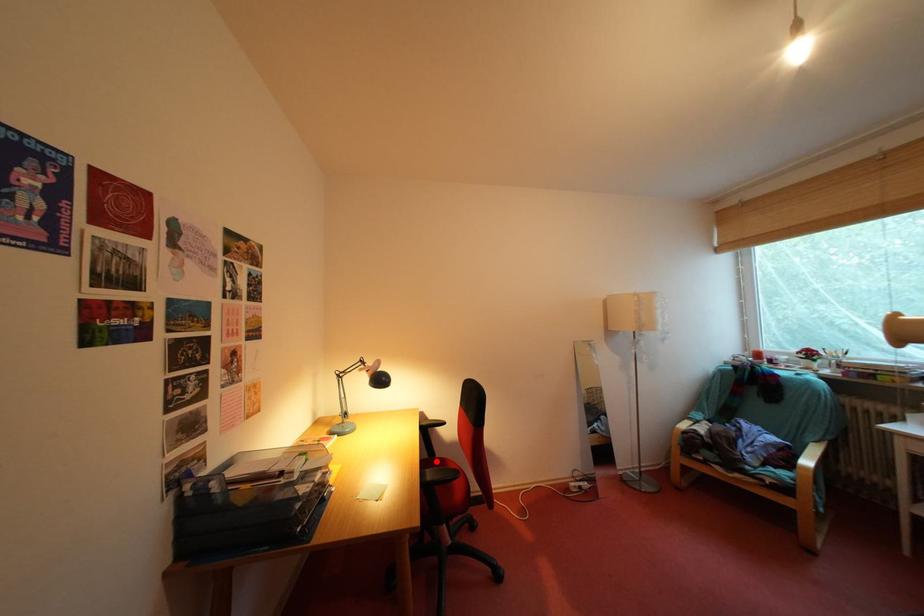
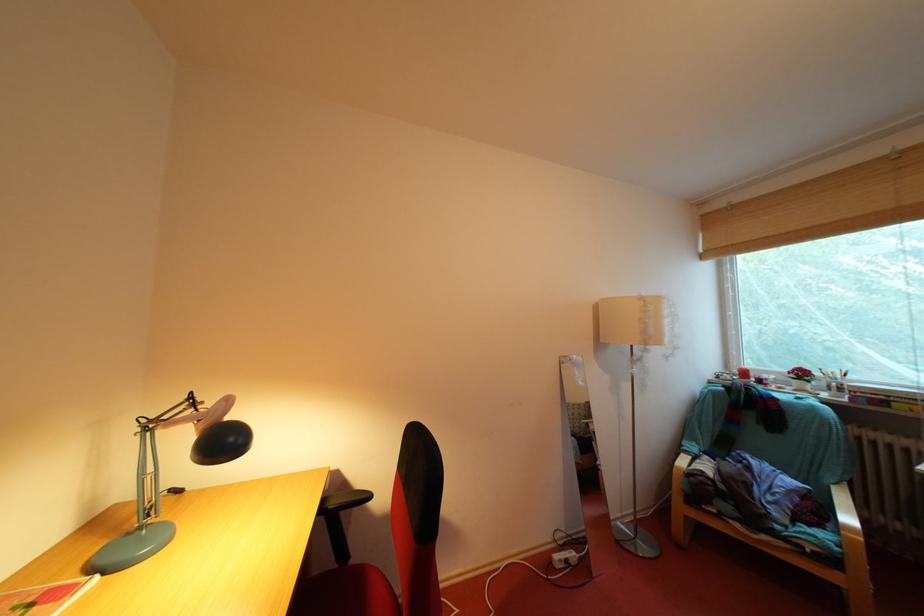
Locate, in the second image, the point that corresponds to the highlighted location in the first image.

(342, 569)